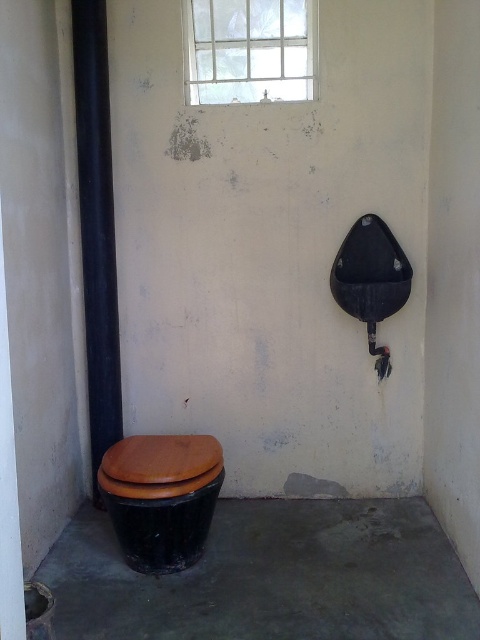
Question: Among these points, which one is farthest from the camera?

Choices:
 (A) (x=56, y=547)
 (B) (x=173, y=531)

Answer: (A)

Question: Is the position of clear glass window at upper center more distant than that of brown matte toilet lid at lower left?

Choices:
 (A) yes
 (B) no

Answer: (A)

Question: Does black matte cement at lower left appear on the left side of brown matte toilet lid at lower left?

Choices:
 (A) no
 (B) yes

Answer: (A)

Question: Which point appears closest to the camera in this image?

Choices:
 (A) (195, 467)
 (B) (144, 493)
 (C) (180, 621)

Answer: (C)

Question: Does black matte cement at lower left have a larger size compared to brown matte toilet lid at lower left?

Choices:
 (A) yes
 (B) no

Answer: (A)

Question: Which of the following is the farthest from the observer?

Choices:
 (A) clear glass window at upper center
 (B) brown matte toilet lid at lower left

Answer: (A)